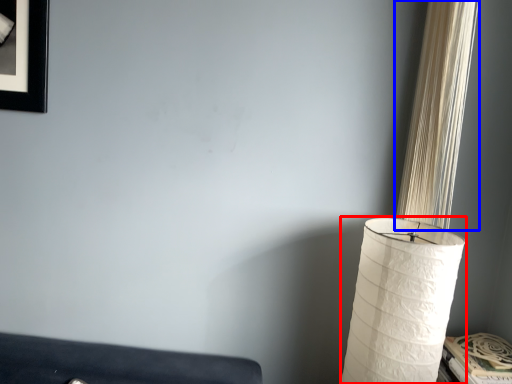
Question: Which point is further to the camera, lamp (highlighted by a red box) or curtain (highlighted by a blue box)?

Choices:
 (A) lamp
 (B) curtain

Answer: (B)